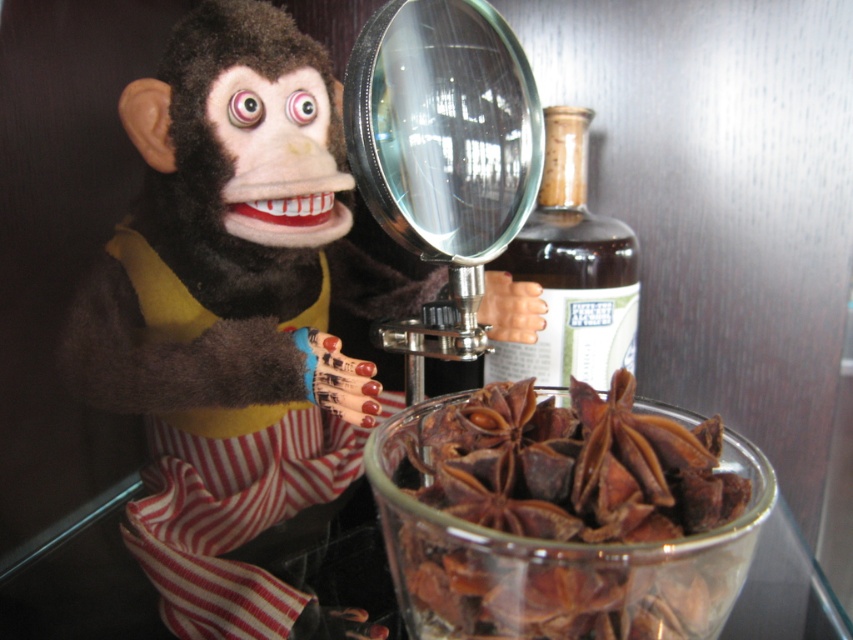
Question: Is transparent glass magnifying glass at center positioned behind brown glass bottle at center?

Choices:
 (A) yes
 (B) no

Answer: (B)

Question: Among these objects, which one is farthest from the camera?

Choices:
 (A) transparent glass magnifying glass at center
 (B) brown papery star anise at center
 (C) velvet plush monkey at center
 (D) brown glass bottle at center

Answer: (D)

Question: From the image, what is the correct spatial relationship of velvet plush monkey at center in relation to brown papery star anise at center?

Choices:
 (A) above
 (B) below

Answer: (A)

Question: Is velvet plush monkey at center positioned before transparent glass magnifying glass at center?

Choices:
 (A) yes
 (B) no

Answer: (B)

Question: Which is farther from the transparent glass magnifying glass at center?

Choices:
 (A) brown papery star anise at center
 (B) brown glass bottle at center

Answer: (B)

Question: Estimate the real-world distances between objects in this image. Which object is closer to the brown papery star anise at center?

Choices:
 (A) velvet plush monkey at center
 (B) brown glass bottle at center
 (C) transparent glass magnifying glass at center

Answer: (C)